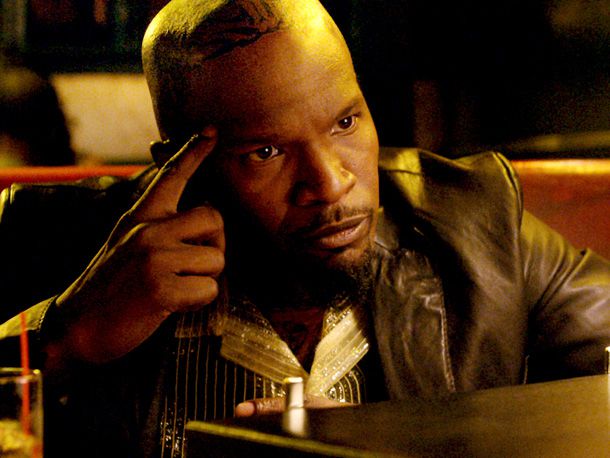
Where is `red booth`? red booth is located at coordinates (585, 237), (551, 191), (594, 191).